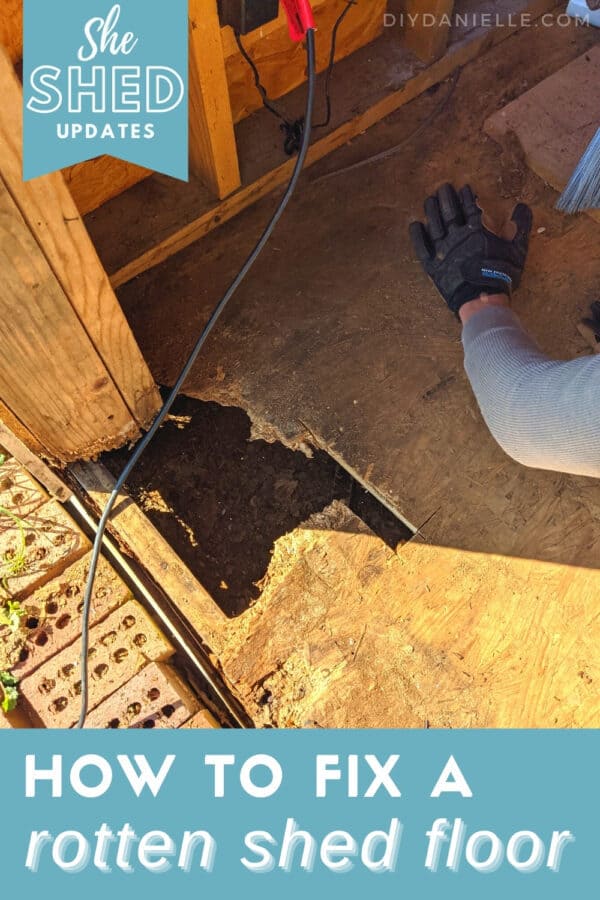
The image size is (600, 900). In order to click on plywood in this screenshot , I will do `click(341, 648)`.